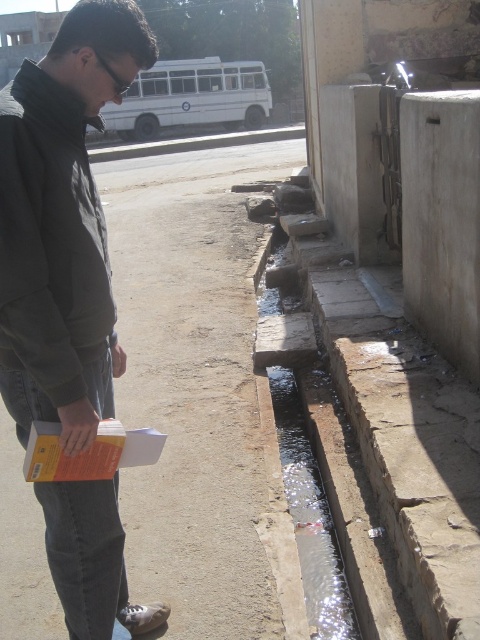
You are a pedestrian trying to cross the road to reach the white bus with blue markings. There is a point marked at coordinates (61, 224) where the dark gray jacket at left is located. If you start from this point, in which direction should you walk to reach the bus?

The dark gray jacket at left is located at point (61, 224). Since the white bus with blue markings is on the far side of the road, you should walk towards the direction opposite to the jacket to reach the bus.

From the picture: You are a city planner analyzing the layout of this urban area. The dark gray jacket at left is located at coordinates 0.350, 0.129. Based on this information, can you determine if the jacket is positioned closer to the water channel or the parked white bus with blue markings?

The dark gray jacket at left is positioned closer to the water channel because its coordinates are closer to the channel than the bus.